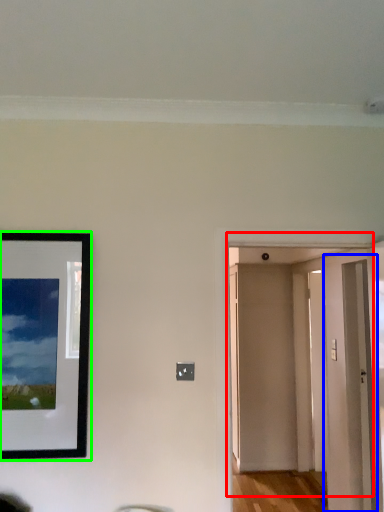
Question: Based on their relative distances, which object is farther from door (highlighted by a red box)? Choose from glass door (highlighted by a blue box) and picture frame (highlighted by a green box).

Choices:
 (A) glass door
 (B) picture frame

Answer: (B)